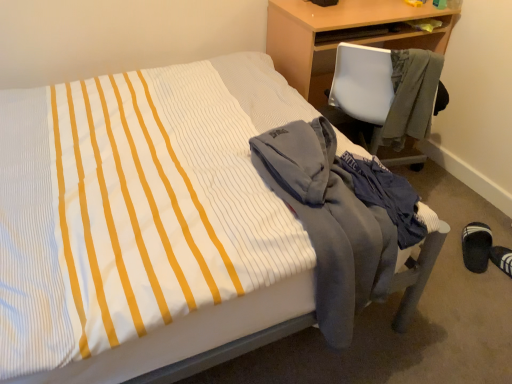
Question: Is black fabric slipper at lower right at the back of gray fleece jacket at lower right, which appears as the 2th jacket when viewed from the right?

Choices:
 (A) no
 (B) yes

Answer: (A)

Question: From the image's perspective, would you say gray fleece jacket at lower right, which appears as the 2th jacket when viewed from the right, is positioned over black fabric slipper at lower right?

Choices:
 (A) yes
 (B) no

Answer: (A)

Question: Can you confirm if gray fleece jacket at lower right, which ranks as the first jacket in left-to-right order, is thinner than black fabric slipper at lower right?

Choices:
 (A) yes
 (B) no

Answer: (B)

Question: Is gray fleece jacket at lower right, the 1th jacket when ordered from bottom to top, at the right side of black fabric slipper at lower right?

Choices:
 (A) yes
 (B) no

Answer: (B)

Question: From the image's perspective, does gray fleece jacket at lower right, which ranks as the first jacket in left-to-right order, appear lower than black fabric slipper at lower right?

Choices:
 (A) yes
 (B) no

Answer: (B)

Question: In terms of size, does gray fleece jacket at right, which is the second jacket from left to right, appear bigger or smaller than wooden desk at upper right?

Choices:
 (A) small
 (B) big

Answer: (A)

Question: Is gray fleece jacket at right, the 1th jacket viewed from the right, inside the boundaries of wooden desk at upper right, or outside?

Choices:
 (A) outside
 (B) inside

Answer: (A)

Question: In terms of width, does gray fleece jacket at right, which is the second jacket from left to right, look wider or thinner when compared to wooden desk at upper right?

Choices:
 (A) thin
 (B) wide

Answer: (A)

Question: Does point (408, 72) appear closer or farther from the camera than point (382, 16)?

Choices:
 (A) closer
 (B) farther

Answer: (A)

Question: Is gray fleece jacket at right, the second jacket when ordered from bottom to top, taller or shorter than gray fleece jacket at lower right, the 1th jacket when ordered from bottom to top?

Choices:
 (A) short
 (B) tall

Answer: (A)

Question: Is point (399, 105) positioned closer to the camera than point (326, 263)?

Choices:
 (A) closer
 (B) farther

Answer: (B)

Question: Is gray fleece jacket at right, placed as the 1th jacket when sorted from top to bottom, in front of or behind gray fleece jacket at lower right, the second jacket from the top, in the image?

Choices:
 (A) front
 (B) behind

Answer: (B)

Question: Choose the correct answer: Is gray fleece jacket at right, the second jacket when ordered from bottom to top, inside gray fleece jacket at lower right, which ranks as the first jacket in left-to-right order, or outside it?

Choices:
 (A) inside
 (B) outside

Answer: (B)

Question: In terms of width, does gray fleece jacket at right, placed as the 1th jacket when sorted from top to bottom, look wider or thinner when compared to black fabric slipper at lower right?

Choices:
 (A) wide
 (B) thin

Answer: (B)

Question: Considering their positions, is gray fleece jacket at right, placed as the 1th jacket when sorted from top to bottom, located in front of or behind black fabric slipper at lower right?

Choices:
 (A) behind
 (B) front

Answer: (B)